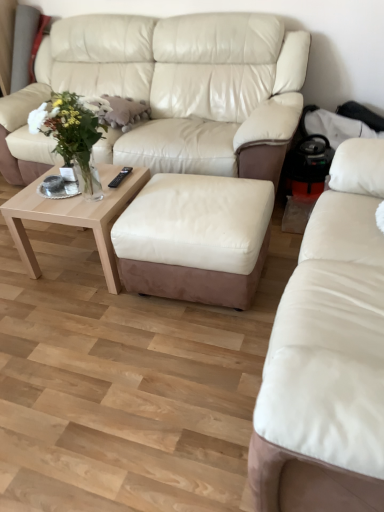
Locate an element on the screen. free space on the front side of white leather ottoman at center is located at coordinates (182, 356).